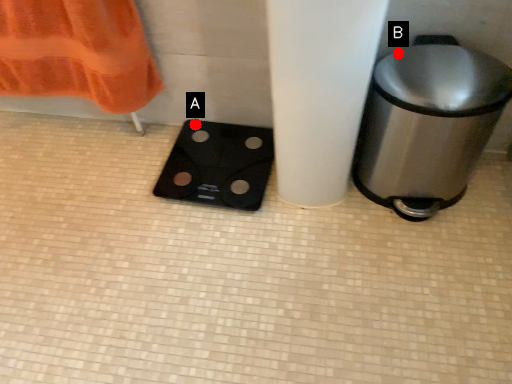
Question: Two points are circled on the image, labeled by A and B beside each circle. Which point is closer to the camera taking this photo?

Choices:
 (A) A is closer
 (B) B is closer

Answer: (B)